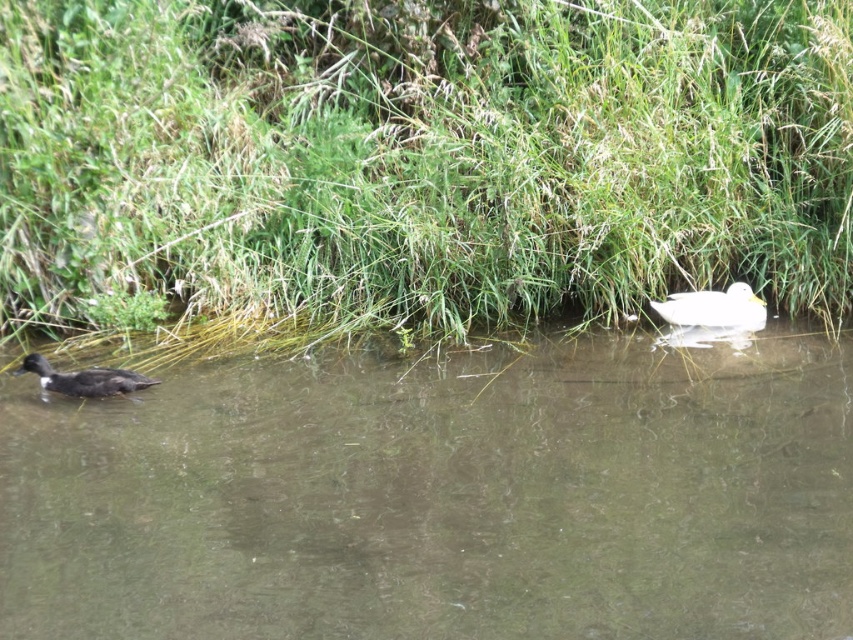
Question: Does white matte duck at upper center lie behind dark brown feathers at lower left?

Choices:
 (A) no
 (B) yes

Answer: (B)

Question: Is green grass at center bigger than white matte duck at upper center?

Choices:
 (A) no
 (B) yes

Answer: (B)

Question: Which of these objects is positioned farthest from the dark brown feathers at lower left?

Choices:
 (A) white matte duck at upper center
 (B) brown murky water at lower left

Answer: (A)

Question: Based on their relative distances, which object is farther from the dark brown feathers at lower left?

Choices:
 (A) brown murky water at lower left
 (B) white matte duck at upper center

Answer: (B)

Question: Which point is closer to the camera taking this photo?

Choices:
 (A) (134, 620)
 (B) (36, 364)
 (C) (689, 307)
 (D) (369, 120)

Answer: (A)

Question: In this image, where is green grass at center located relative to brown murky water at lower left?

Choices:
 (A) above
 (B) below

Answer: (A)